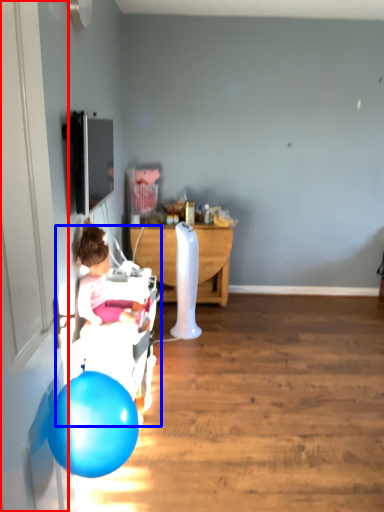
Question: Which object appears farthest to the camera in this image, door (highlighted by a red box) or baby carriage (highlighted by a blue box)?

Choices:
 (A) door
 (B) baby carriage

Answer: (B)